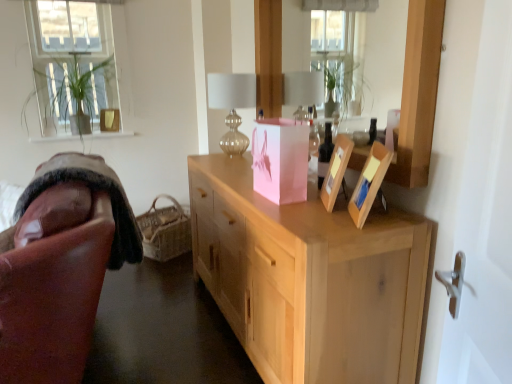
You are a GUI agent. You are given a task and a screenshot of the screen. Output one action in this format:
    pyautogui.click(x=<x>, y=<y>)
    Task: Click on the free spot in front of pink paper bag at center
    
    Given the screenshot: What is the action you would take?
    pyautogui.click(x=291, y=214)